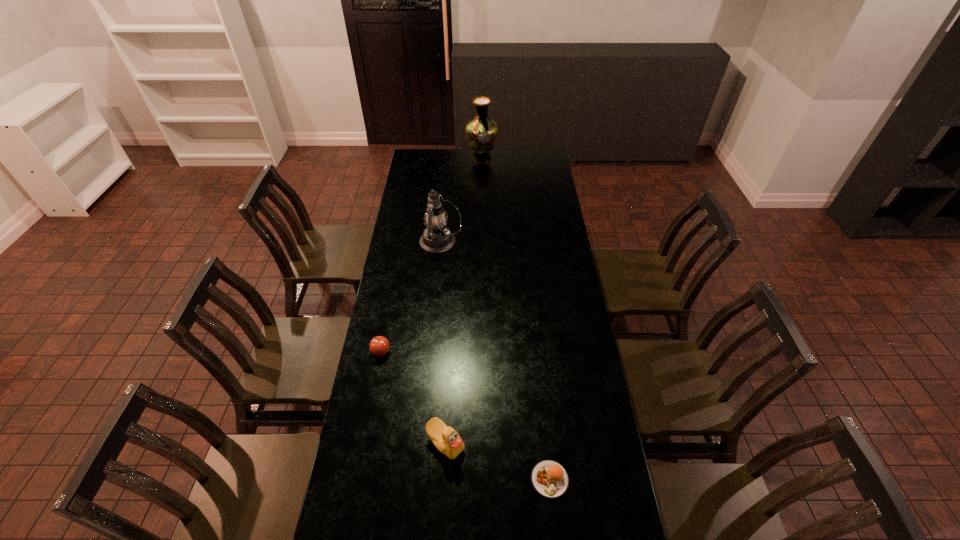
Identify the location of vacant space located on the right of the second farthest object. This screenshot has height=540, width=960. pos(507,242).

Identify the location of free space located 0.050m at the beak of the third shortest object. The width and height of the screenshot is (960, 540). (444, 478).

The height and width of the screenshot is (540, 960). Find the location of `vacant space positioned on the back of the third farthest object`. vacant space positioned on the back of the third farthest object is located at coordinates (396, 272).

Locate an element on the screen. The height and width of the screenshot is (540, 960). blank area located 0.340m on the left of the patty is located at coordinates (420, 480).

This screenshot has width=960, height=540. In order to click on object that is positioned at the far edge in this screenshot , I will do `click(481, 132)`.

Identify the location of oil lamp present at the left edge. (437, 238).

Where is `apple that is at the left edge`? Image resolution: width=960 pixels, height=540 pixels. apple that is at the left edge is located at coordinates (379, 346).

Find the location of `object that is at the right edge`. object that is at the right edge is located at coordinates pos(549,478).

I want to click on vacant space at the far edge, so click(519, 149).

Identify the location of vacant area at the left edge. (417, 193).